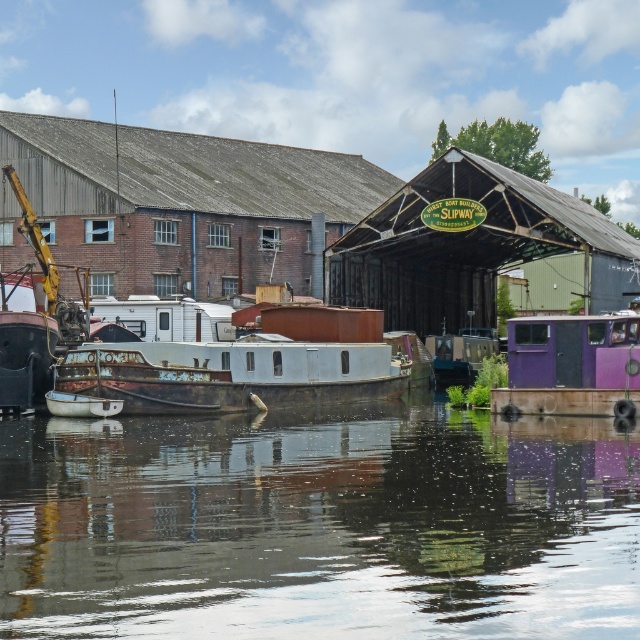
Is glossy water at center in front of rusty metal boat at center?

Yes, it is.

Is glossy water at center wider than rusty metal boat at center?

Yes.

This screenshot has width=640, height=640. I want to click on glossy water at center, so click(317, 525).

Where is `glossy water at center`? The height and width of the screenshot is (640, 640). glossy water at center is located at coordinates (317, 525).

How distant is glossy water at center from purple matte truck at lower right?

glossy water at center is 9.59 meters from purple matte truck at lower right.

Between glossy water at center and purple matte truck at lower right, which one is positioned higher?

purple matte truck at lower right

The height and width of the screenshot is (640, 640). I want to click on glossy water at center, so click(x=317, y=525).

Which is below, rusty metal boat at center or purple matte truck at lower right?

rusty metal boat at center is lower down.

Is point (220, 356) closer to camera compared to point (536, 330)?

No.

Locate an element on the screen. Image resolution: width=640 pixels, height=640 pixels. rusty metal boat at center is located at coordinates (230, 372).